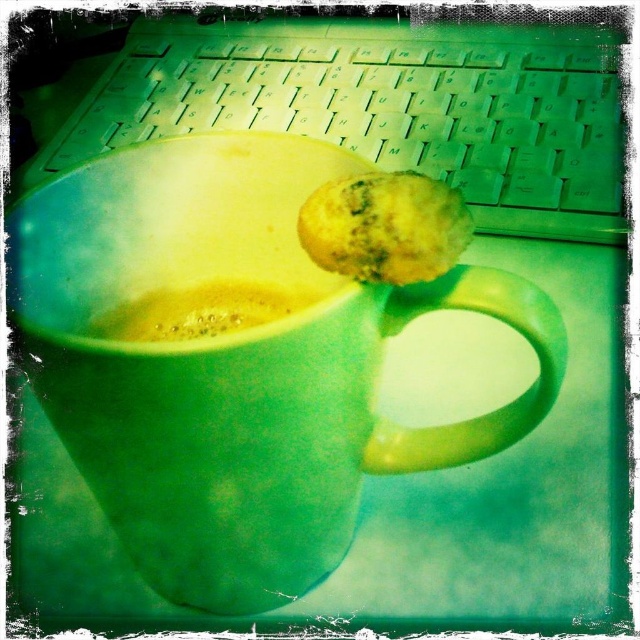
You are a barista trying to place a new cup on the desk without spilling the contents. The desk has a coordinate system where the bottom left corner is the origin. The yellowish matte muffin at center is at point (385, 227). If you want to place the new cup so it doesn t touch the muffin, what coordinate should you choose?

The yellowish matte muffin at center is represented by point (385, 227), so placing the new cup at a coordinate that is not overlapping with this point, such as 0.5, 0.5, would ensure it doesn t touch the muffin.